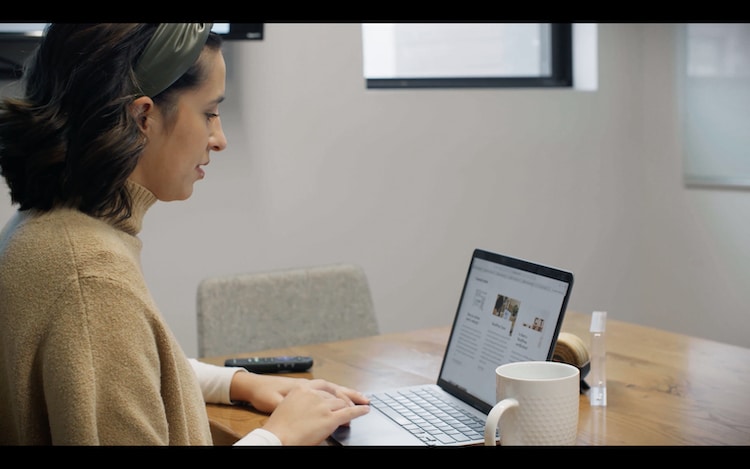
The height and width of the screenshot is (469, 750). I want to click on laptop computer, so click(368, 426).